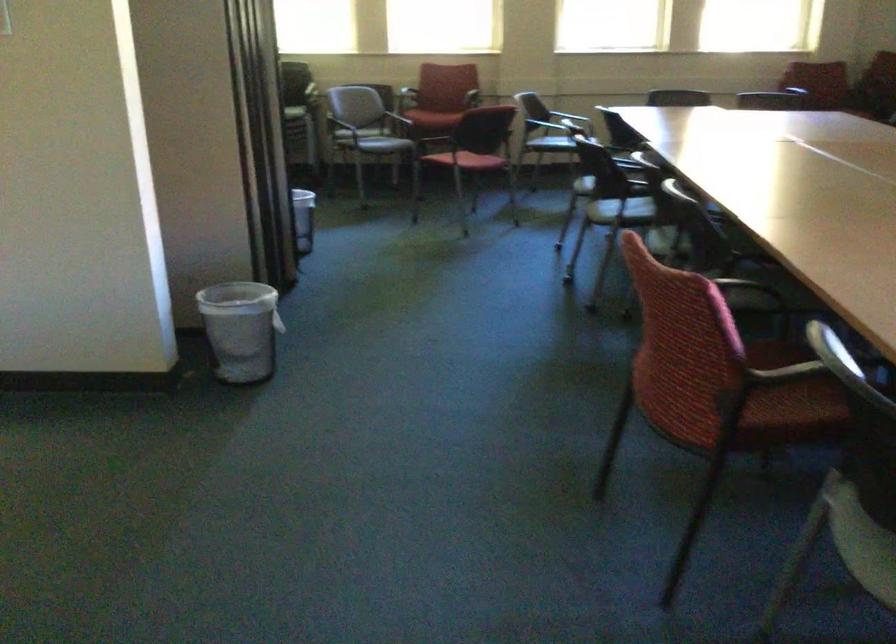
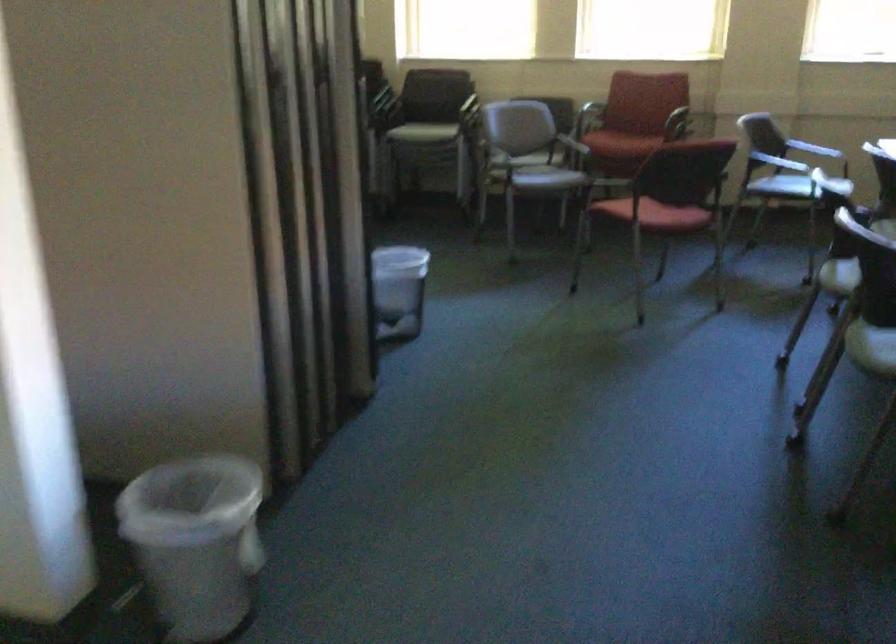
Find the pixel in the second image that matches point (483, 165) in the first image.

(660, 214)